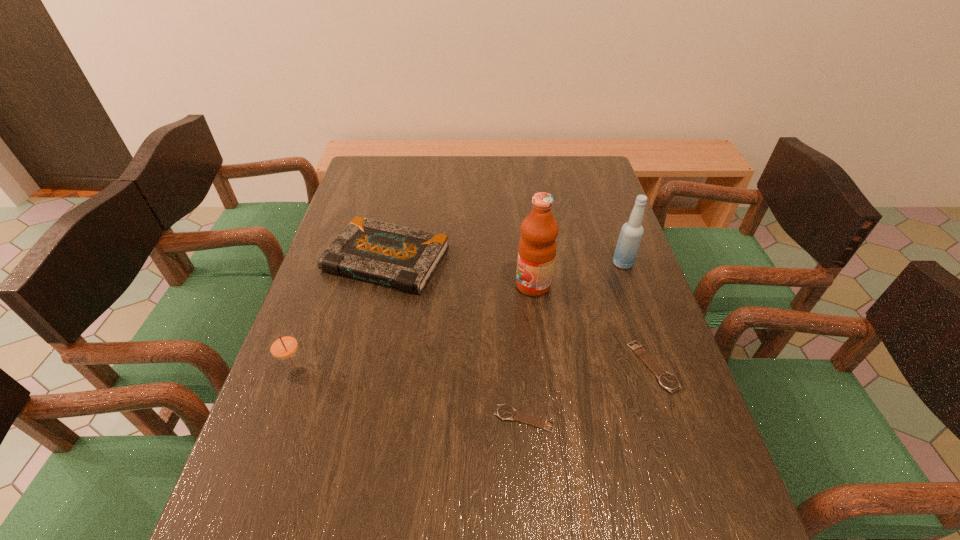
What are the coordinates of `free space located on the front label of the fruit juice` in the screenshot? It's located at (479, 285).

The width and height of the screenshot is (960, 540). Identify the location of vacant space located on the front label of the fruit juice. (423, 285).

The image size is (960, 540). Find the location of `vacant region located on the front label of the fruit juice`. vacant region located on the front label of the fruit juice is located at coordinates (372, 285).

Identify the location of vacant region located 0.280m on the front of the fourth tallest object. (356, 389).

Where is `free space located 0.070m on the front of the bottle`? free space located 0.070m on the front of the bottle is located at coordinates coord(632,289).

This screenshot has width=960, height=540. What are the coordinates of `free region located 0.110m on the right of the third tallest object` in the screenshot? It's located at (359, 375).

Find the location of a particular element. The height and width of the screenshot is (540, 960). notebook that is at the left edge is located at coordinates (405, 258).

The width and height of the screenshot is (960, 540). I want to click on straw that is positioned at the left edge, so click(283, 345).

Find the location of `watch that is at the right edge`. watch that is at the right edge is located at coordinates (666, 380).

The height and width of the screenshot is (540, 960). In order to click on bottle located at the right edge in this screenshot , I will do `click(631, 234)`.